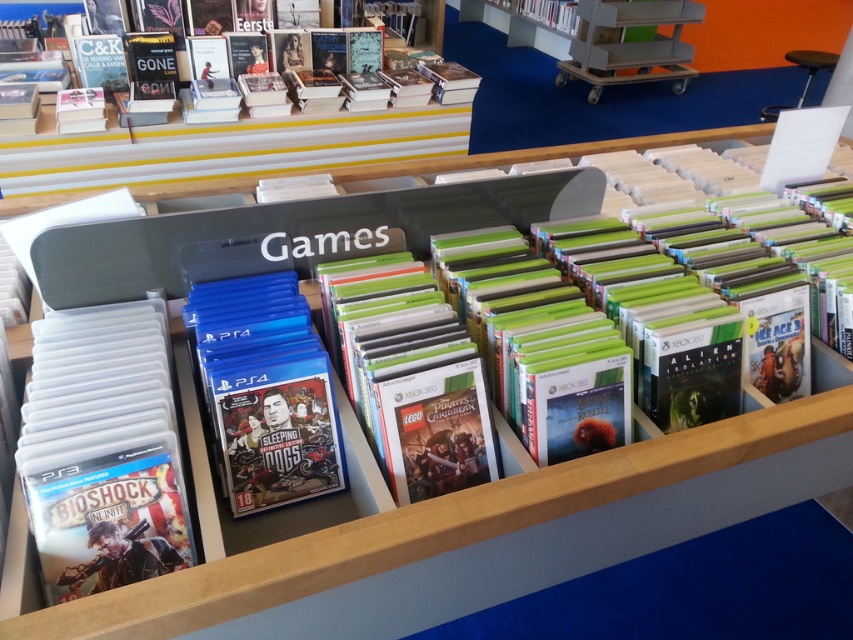
You are a customer browsing the games section in the store. You see the clear plastic case at left and the blue plastic game case at center. Which one can you see more clearly from your current position?

The clear plastic case at left is closer to the viewer than the blue plastic game case at center, so you can see the clear plastic case at left more clearly.

What is located at the point marked by the coordinates (x=103, y=451) in the image?

The clear plastic case at left is located at point (x=103, y=451).